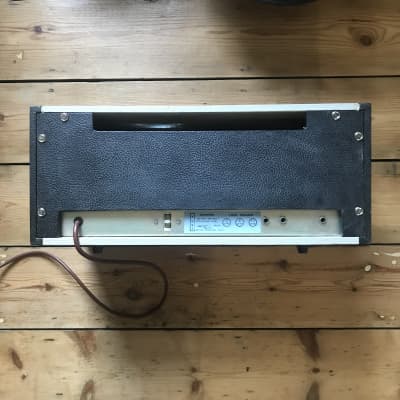
Identify the location of black cord. (156, 128).